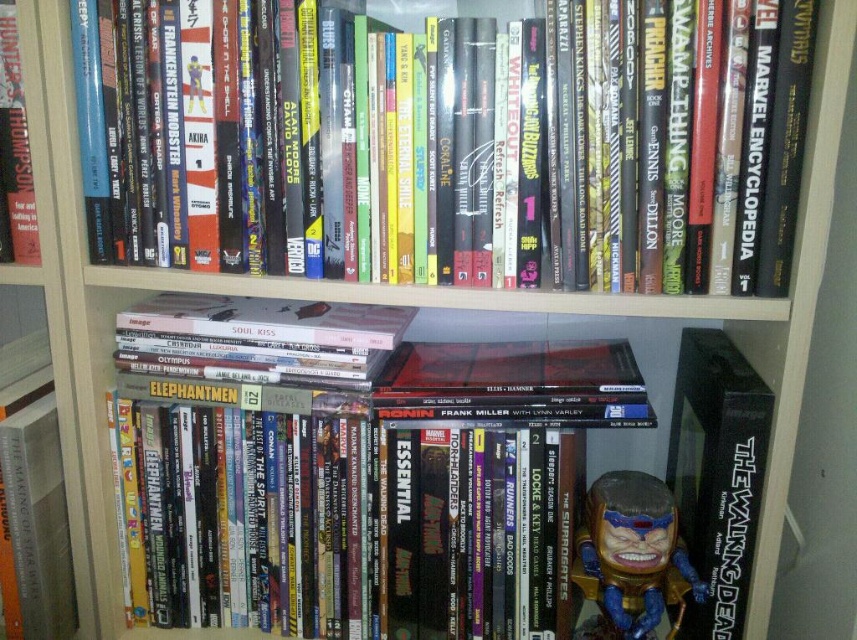
The height and width of the screenshot is (640, 857). Describe the element at coordinates (453, 144) in the screenshot. I see `hardcover books at upper center` at that location.

Describe the element at coordinates (453, 144) in the screenshot. The height and width of the screenshot is (640, 857). I see `hardcover books at upper center` at that location.

In order to click on hardcover books at upper center in this screenshot , I will do `click(453, 144)`.

Can you confirm if hardcover books at upper center is smaller than shiny metallic figure at center?

Actually, hardcover books at upper center might be larger than shiny metallic figure at center.

Does hardcover books at upper center come behind shiny metallic figure at center?

No, it is in front of shiny metallic figure at center.

Locate an element on the screen. The image size is (857, 640). hardcover books at upper center is located at coordinates (453, 144).

Locate an element on the screen. This screenshot has width=857, height=640. hardcover books at upper center is located at coordinates pos(453,144).

Between black matte book at center and shiny metallic figure at center, which one appears on the right side from the viewer's perspective?

From the viewer's perspective, black matte book at center appears more on the right side.

The height and width of the screenshot is (640, 857). In order to click on black matte book at center in this screenshot , I will do `click(717, 474)`.

Where is `black matte book at center`? The width and height of the screenshot is (857, 640). black matte book at center is located at coordinates (717, 474).